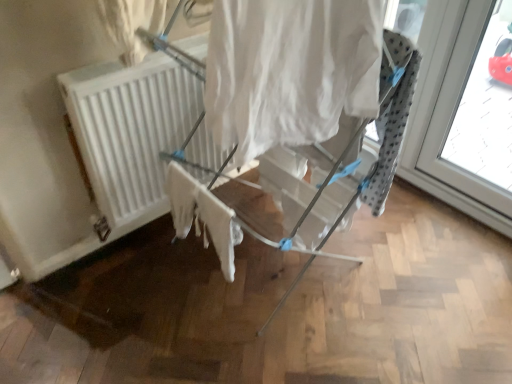
Question: Is white cotton cloth at center next to white matte radiator at center and touching it?

Choices:
 (A) no
 (B) yes

Answer: (A)

Question: From the image's perspective, is white cotton cloth at center located above white matte radiator at center?

Choices:
 (A) no
 (B) yes

Answer: (A)

Question: Is white cotton cloth at center not within white matte radiator at center?

Choices:
 (A) no
 (B) yes

Answer: (B)

Question: Is white cotton cloth at center facing away from white matte radiator at center?

Choices:
 (A) no
 (B) yes

Answer: (B)

Question: From a real-world perspective, is white cotton cloth at center located beneath white matte radiator at center?

Choices:
 (A) yes
 (B) no

Answer: (A)

Question: Relative to white fabric curtain at center, is white matte radiator at center in front or behind?

Choices:
 (A) behind
 (B) front

Answer: (A)

Question: Looking at their shapes, would you say white matte radiator at center is wider or thinner than white fabric curtain at center?

Choices:
 (A) thin
 (B) wide

Answer: (A)

Question: In terms of height, does white matte radiator at center look taller or shorter compared to white fabric curtain at center?

Choices:
 (A) tall
 (B) short

Answer: (A)

Question: Which is correct: white matte radiator at center is inside white fabric curtain at center, or outside of it?

Choices:
 (A) inside
 (B) outside

Answer: (B)

Question: From the image's perspective, is white fabric drying rack at center above or below white matte radiator at center?

Choices:
 (A) above
 (B) below

Answer: (B)

Question: In the image, is white fabric drying rack at center positioned in front of or behind white matte radiator at center?

Choices:
 (A) behind
 (B) front

Answer: (B)

Question: Considering the positions of white fabric drying rack at center and white matte radiator at center in the image, is white fabric drying rack at center bigger or smaller than white matte radiator at center?

Choices:
 (A) small
 (B) big

Answer: (B)

Question: Choose the correct answer: Is white fabric drying rack at center inside white matte radiator at center or outside it?

Choices:
 (A) outside
 (B) inside

Answer: (A)

Question: Is white cotton cloth at center taller or shorter than white fabric drying rack at center?

Choices:
 (A) tall
 (B) short

Answer: (B)

Question: From a real-world perspective, is white cotton cloth at center physically located above or below white fabric drying rack at center?

Choices:
 (A) above
 (B) below

Answer: (B)